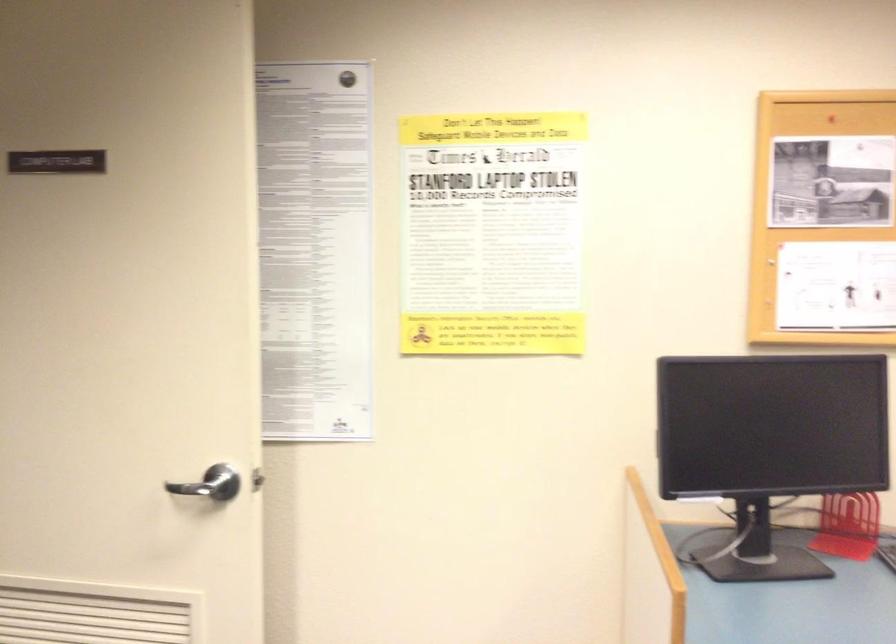
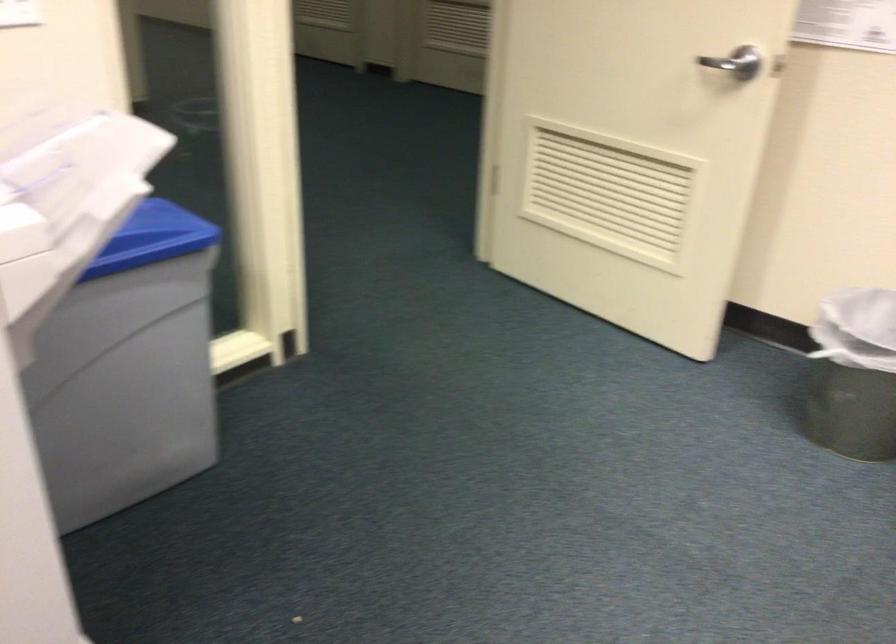
Locate, in the second image, the point that corresponds to point (208, 487) in the first image.

(736, 62)